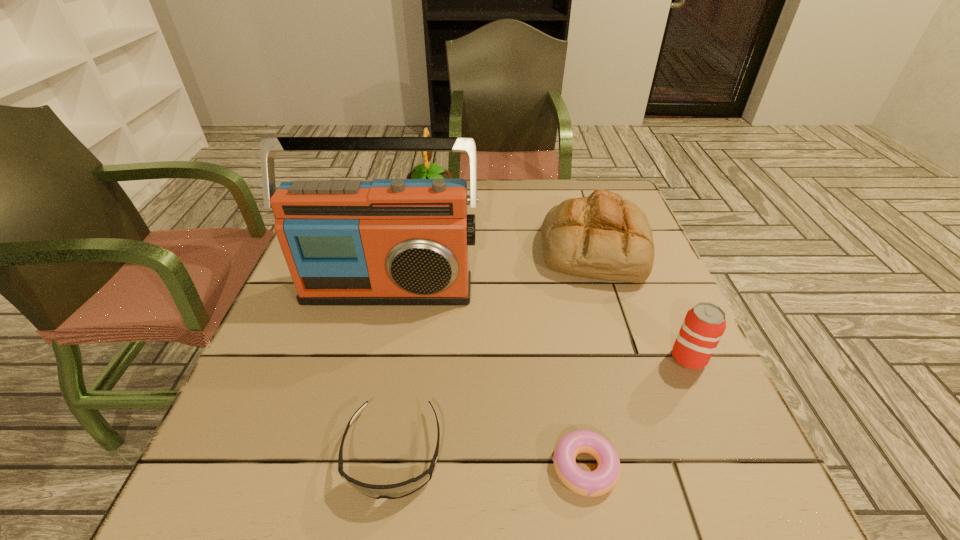
You are a GUI agent. You are given a task and a screenshot of the screen. Output one action in this format:
    pyautogui.click(x=<x>, y=<y>)
    Task: Click on the radio receiver
    This screenshot has width=960, height=540.
    Given the screenshot: What is the action you would take?
    pyautogui.click(x=388, y=241)

Where is `the farthest object`? This screenshot has width=960, height=540. the farthest object is located at coordinates (423, 171).

This screenshot has width=960, height=540. I want to click on sunflower, so click(x=423, y=171).

Find the location of a particular element. This screenshot has height=540, width=960. bread is located at coordinates (602, 236).

You are a GUI agent. You are given a task and a screenshot of the screen. Output one action in this format:
    pyautogui.click(x=<x>, y=<y>)
    Task: Click on the fourth farthest object
    The width and height of the screenshot is (960, 540).
    Given the screenshot: What is the action you would take?
    coord(704,324)

The image size is (960, 540). I want to click on goggles, so click(x=391, y=491).

This screenshot has width=960, height=540. What are the coordinates of `the shortest object` in the screenshot? It's located at (600, 481).

Identify the location of vacant position located 0.330m on the front-facing side of the tallest object. The width and height of the screenshot is (960, 540). (348, 457).

The image size is (960, 540). Identify the location of vacant space located 0.180m on the face of the farthest object. (512, 193).

This screenshot has height=540, width=960. Identify the location of blank area located 0.180m on the front of the bread. (629, 351).